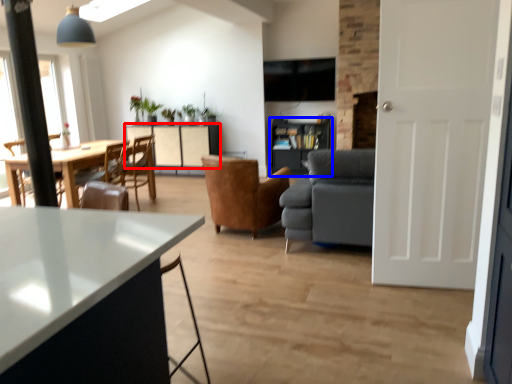
Question: Which point is closer to the camera, cabinetry (highlighted by a red box) or shelf (highlighted by a blue box)?

Choices:
 (A) cabinetry
 (B) shelf

Answer: (B)